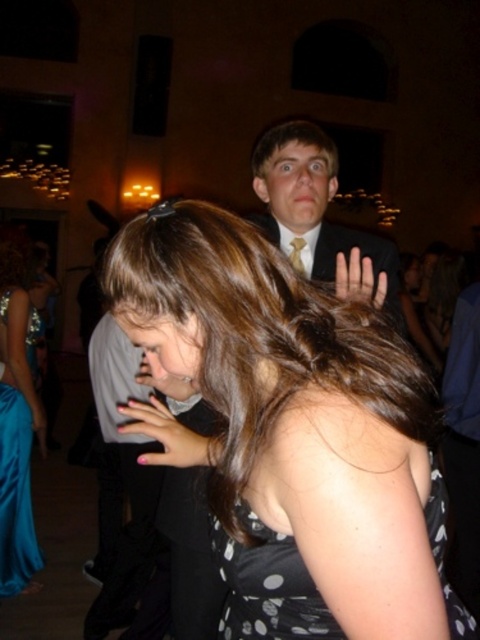
Is matte black suit at upper center shorter than matte skin hand at upper center?

In fact, matte black suit at upper center may be taller than matte skin hand at upper center.

Looking at this image, measure the distance between matte black suit at upper center and matte skin hand at upper center.

4.20 inches

Between point (374, 268) and point (359, 272), which one is positioned behind?

The point (374, 268) is more distant.

The height and width of the screenshot is (640, 480). What are the coordinates of `matte black suit at upper center` in the screenshot? It's located at (312, 205).

Can you confirm if matte black suit at upper center is taller than dark brown hair at upper center?

Yes.

Is point (292, 220) positioned before point (280, 131)?

No, it is behind (280, 131).

This screenshot has width=480, height=640. In order to click on matte black suit at upper center in this screenshot , I will do `click(312, 205)`.

Is black dotted fabric dress at center thinner than matte skin hand at upper center?

Incorrect, black dotted fabric dress at center's width is not less than matte skin hand at upper center's.

Find the location of `black dotted fabric dress at center`. black dotted fabric dress at center is located at coordinates (267, 586).

Is point (283, 634) positioned after point (360, 298)?

No, (283, 634) is in front of (360, 298).

The width and height of the screenshot is (480, 640). I want to click on black dotted fabric dress at center, so click(267, 586).